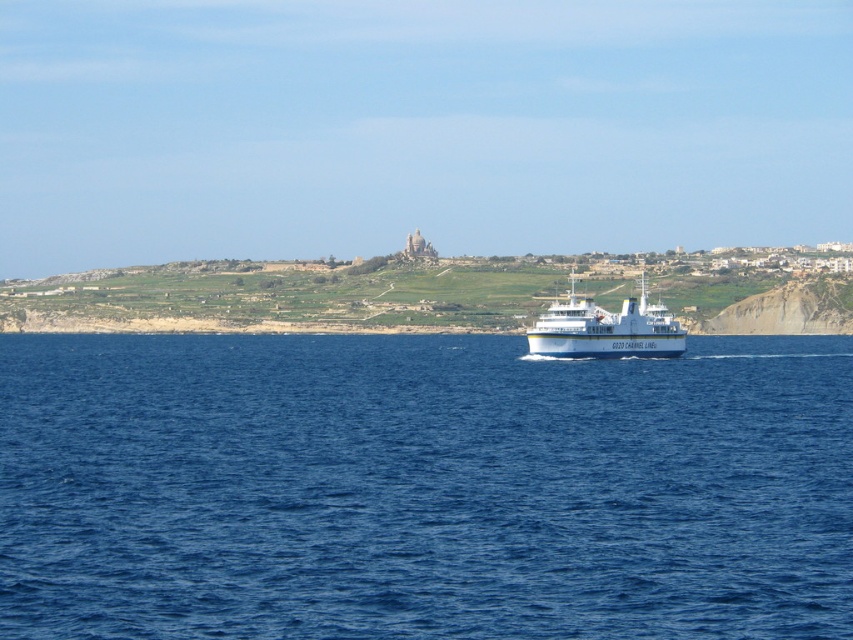
You are standing at the point with coordinates point (363, 573) and want to walk towards the point with coordinates point (605, 326). Which direction should you face to walk directly towards the second point?

→ To walk directly from point (363, 573) to point (605, 326), you should face northeast because point (363, 573) is in front of point (605, 326).

You are a drone operator trying to capture the blue water at center in a photo. The camera has a 100mm lens with a field of view of 14 degrees. If the drone is positioned directly above the ferry boat, marked with

The blue water at center is located at point (422, 488) in 2D coordinates, so if the drone is positioned directly above the ferry boat, it will likely capture the blue water at center within its field of view of 14 degrees using a 100mm lens.